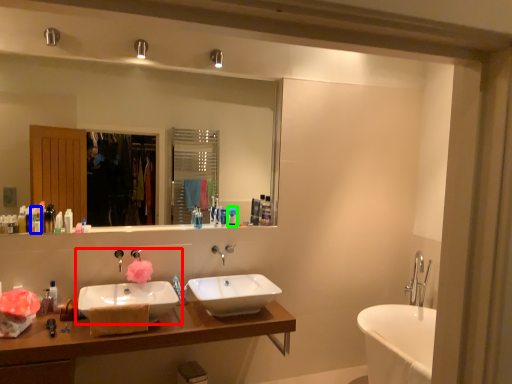
Question: Considering the real-world distances, which object is closest to sink (highlighted by a red box)? toiletry (highlighted by a blue box) or toiletry (highlighted by a green box).

Choices:
 (A) toiletry
 (B) toiletry

Answer: (A)